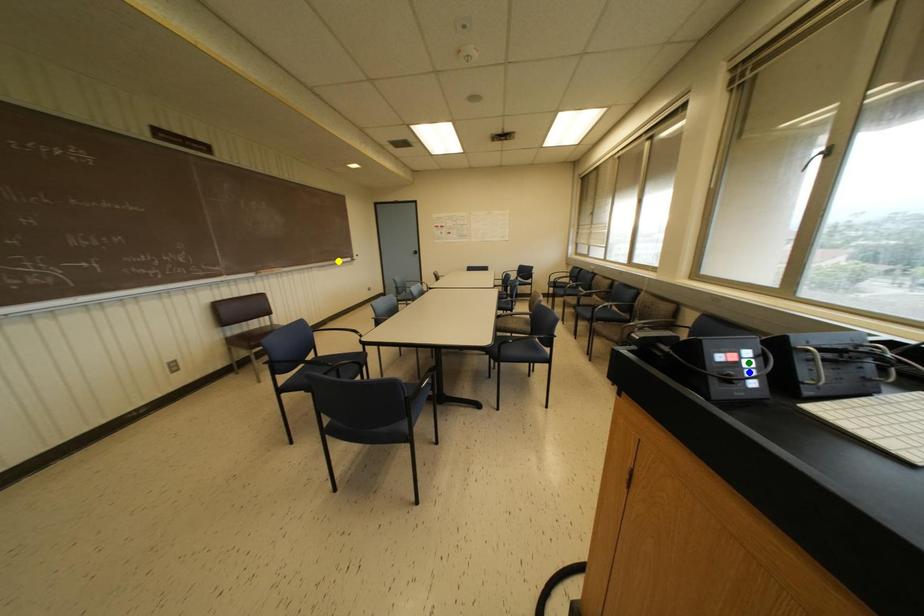
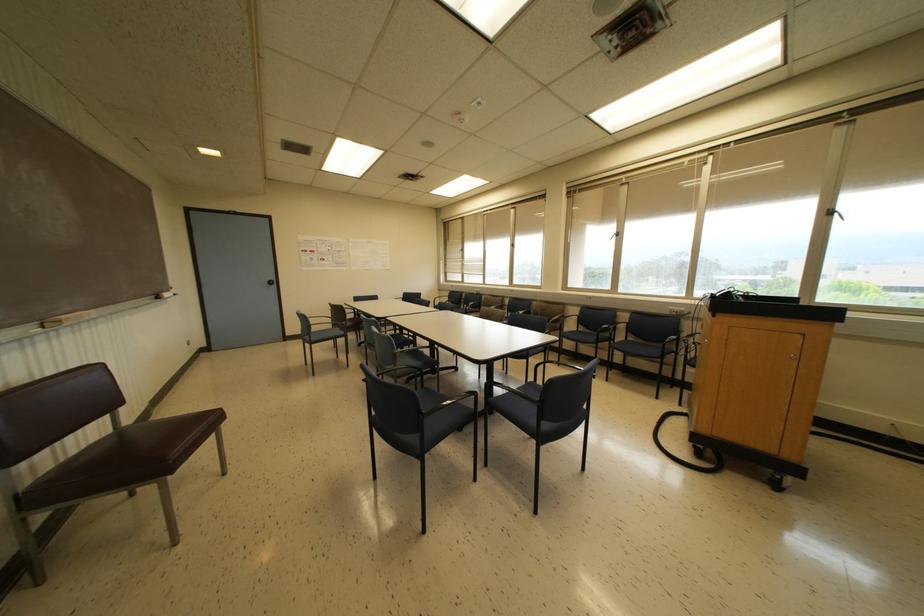
I am providing you with two images of the same scene from different viewpoints. Three points are marked in image1. Which point corresponds to a part or object that is occluded in image2?In image1, three points are marked. Which of them correspond to a part or object that is occluded in image2?Among the three points shown in image1, which one corresponds to a part or object that is no longer visible due to occlusion in image2?

blue point, green point